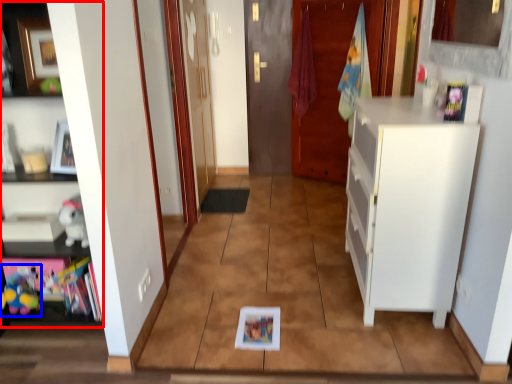
Question: Which object is closer to the camera taking this photo, cabinetry (highlighted by a red box) or toy (highlighted by a blue box)?

Choices:
 (A) cabinetry
 (B) toy

Answer: (A)